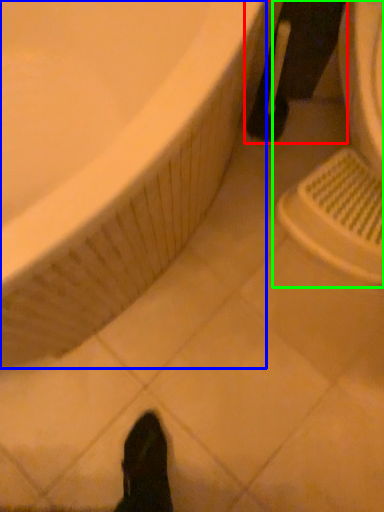
Question: Which is farther away from leg (highlighted by a red box)? bathtub (highlighted by a blue box) or sink (highlighted by a green box)?

Choices:
 (A) bathtub
 (B) sink

Answer: (A)